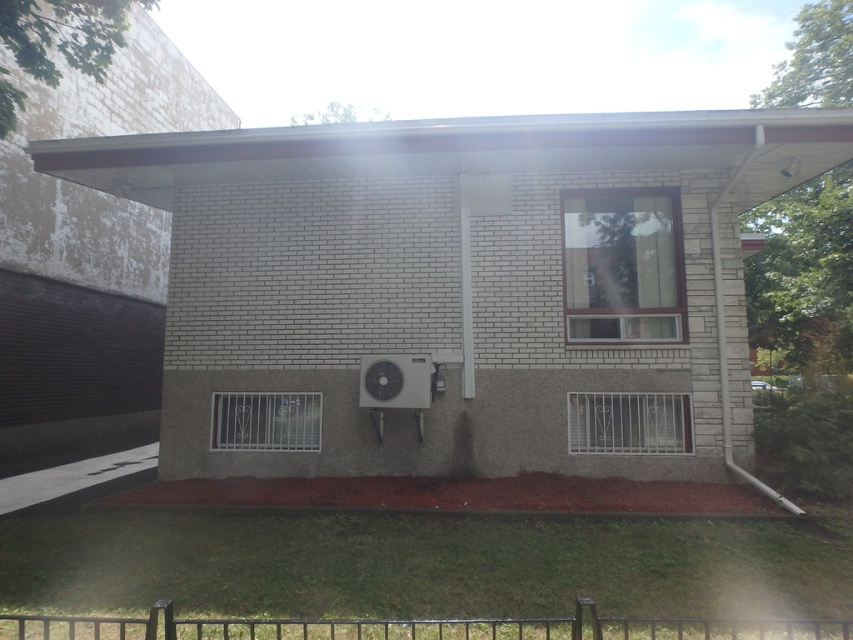
You are a painter standing on a ladder that is 2 meters tall. You need to paint the clear glass window at center and the silver metallic air conditioner at center. Can you reach both with your current ladder height?

The distance between the clear glass window at center and the silver metallic air conditioner at center is 2.28 meters. Since the ladder is only 2 meters tall, you cannot reach the higher one because the vertical distance exceeds the ladder height.

You are standing in front of the building and want to determine the relative positions of two points marked on its facade. Using your perspective, which point is closer to you, point at (621, 451) or point at (364, 387)?

Point at (364, 387) is closer to you because it is less further than point at (621, 451).

You are a delivery person trying to determine the best spot to place a large package. You see the metallic silver window at lower left and the silver metallic air conditioner at center. Which object has a surface large enough to temporarily place the package without obstructing the window or the air conditioner?

The metallic silver window at lower left is larger in size than the silver metallic air conditioner at center, so the metallic silver window at lower left has a larger surface and can accommodate the package without obstruction.